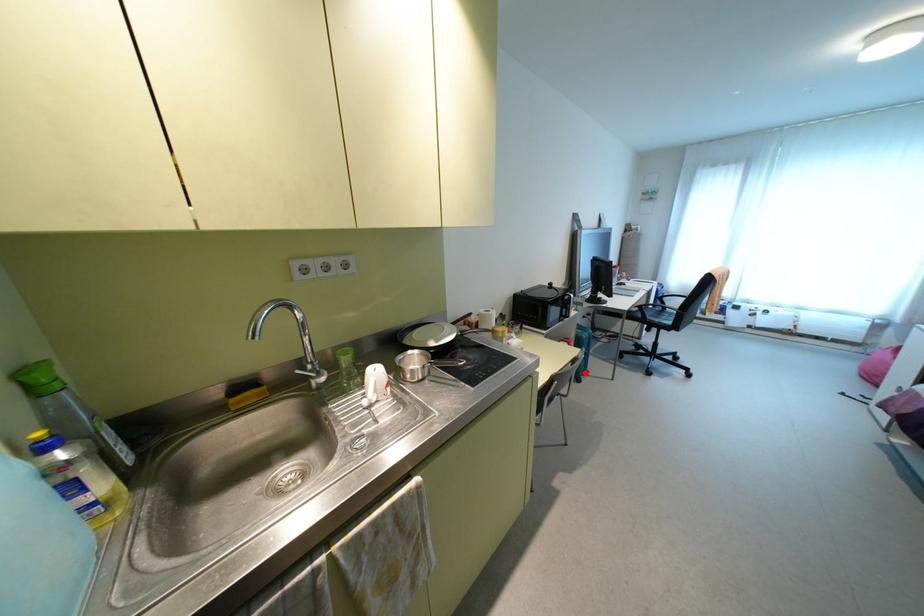
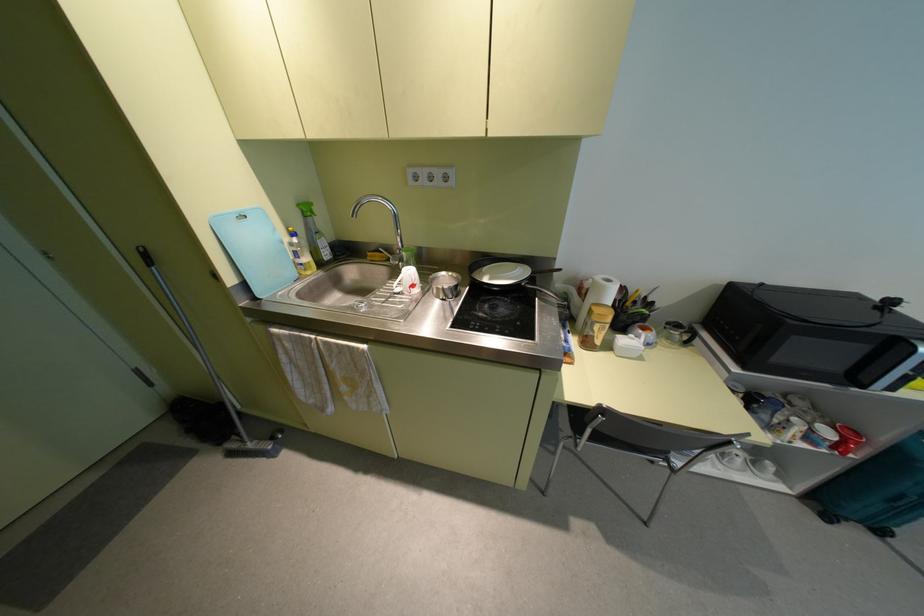
Find the pixel in the second image that matches the highlighted location in the first image.

(880, 531)